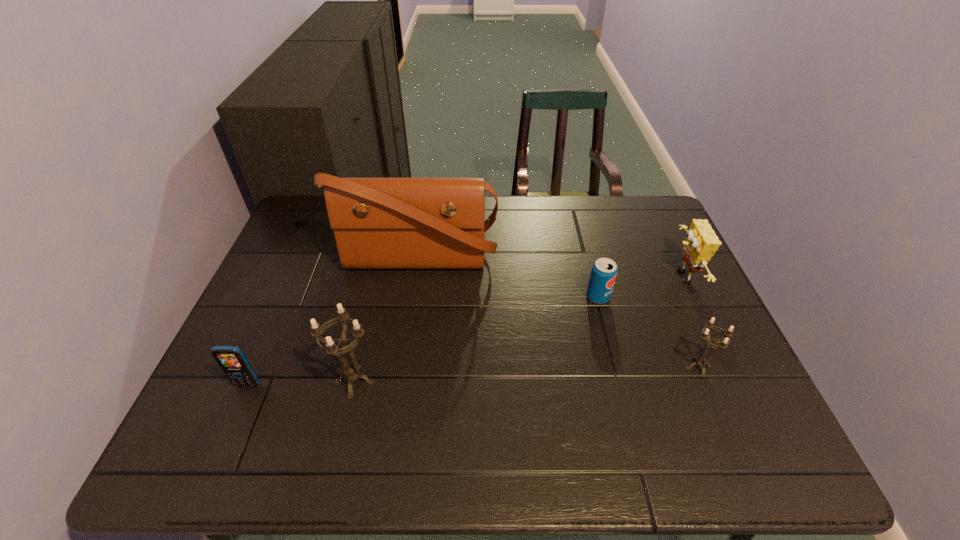
The image size is (960, 540). I want to click on unoccupied area between the fourth object from left to right and the left candle holder, so click(x=476, y=339).

Locate an element on the screen. This screenshot has width=960, height=540. vacant area that lies between the taller candle holder and the shorter candle holder is located at coordinates (526, 374).

This screenshot has width=960, height=540. I want to click on free space between the cellular telephone and the satchel, so 333,322.

Where is `vacant point located between the tallest object and the fourth shortest object`? Image resolution: width=960 pixels, height=540 pixels. vacant point located between the tallest object and the fourth shortest object is located at coordinates (550, 268).

Image resolution: width=960 pixels, height=540 pixels. What are the coordinates of `free spot between the fourth object from left to right and the tallest object` in the screenshot? It's located at (508, 279).

Identify the location of vacant space in between the satchel and the sponge. (550, 268).

Identify the location of free space that is in between the tallest object and the cellular telephone. pos(333,322).

You are a GUI agent. You are given a task and a screenshot of the screen. Output one action in this format:
    pyautogui.click(x=<x>, y=<y>)
    Task: Click on the blank region between the soda can and the tallest object
    The width and height of the screenshot is (960, 540).
    Given the screenshot: What is the action you would take?
    pyautogui.click(x=508, y=279)

Select which object appears as the third closest to the soda can. Please provide its 2D coordinates. Your answer should be formatted as a tuple, i.e. [(x, y)], where the tuple contains the x and y coordinates of a point satisfying the conditions above.

[(379, 223)]

Identify which object is located as the second nearest to the cellular telephone. Please provide its 2D coordinates. Your answer should be formatted as a tuple, i.e. [(x, y)], where the tuple contains the x and y coordinates of a point satisfying the conditions above.

[(379, 223)]